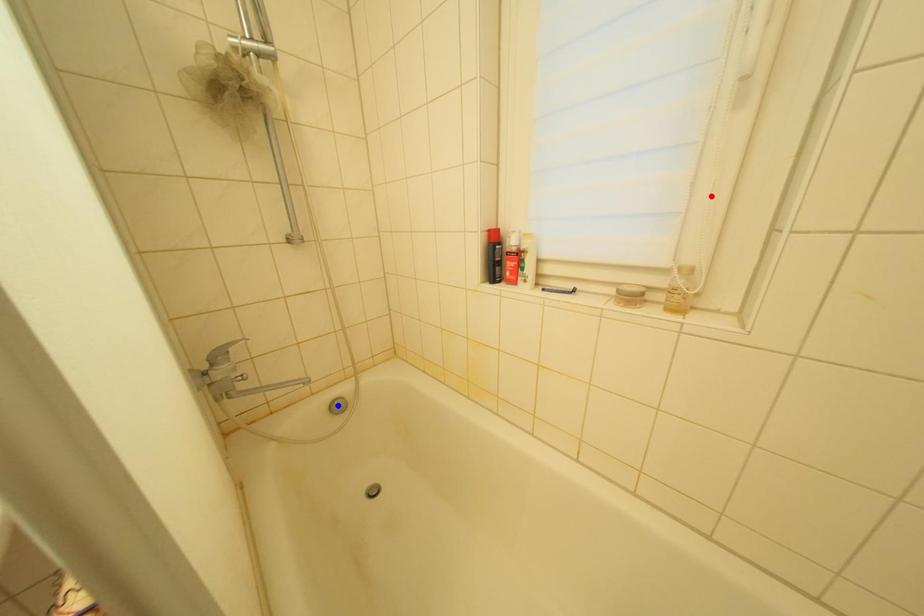
Question: In the image, two points are highlighted. Which point is nearer to the camera? Reply with the corresponding letter.

Choices:
 (A) blue point
 (B) red point

Answer: (B)